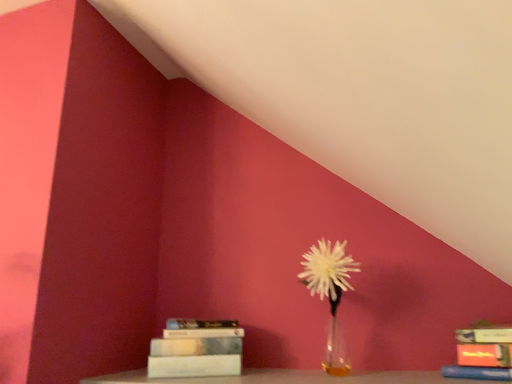
Question: Can we say translucent glass vase at center lies outside hardcover book at lower left, the 1th book positioned from the back?

Choices:
 (A) no
 (B) yes

Answer: (B)

Question: Is translucent glass vase at center wider than hardcover book at lower left, the 1th book positioned from the back?

Choices:
 (A) no
 (B) yes

Answer: (B)

Question: Would you consider translucent glass vase at center to be distant from hardcover book at lower left, the 1th book positioned from the back?

Choices:
 (A) no
 (B) yes

Answer: (A)

Question: Is translucent glass vase at center positioned behind hardcover book at lower left, positioned as the second book in front-to-back order?

Choices:
 (A) no
 (B) yes

Answer: (A)

Question: Is translucent glass vase at center facing away from hardcover book at lower left, the first book from the left?

Choices:
 (A) yes
 (B) no

Answer: (B)

Question: Considering the relative sizes of translucent glass vase at center and hardcover book at lower left, the 1th book positioned from the back, in the image provided, is translucent glass vase at center taller than hardcover book at lower left, the 1th book positioned from the back,?

Choices:
 (A) no
 (B) yes

Answer: (A)

Question: Does hardcover book at lower right, which appears as the 1th book when viewed from the right, appear on the left side of white glass vase at center?

Choices:
 (A) yes
 (B) no

Answer: (B)

Question: Is hardcover book at lower right, acting as the second book starting from the back, oriented away from white glass vase at center?

Choices:
 (A) yes
 (B) no

Answer: (B)

Question: Can you see hardcover book at lower right, which is the second book from left to right, touching white glass vase at center?

Choices:
 (A) yes
 (B) no

Answer: (B)

Question: Is the depth of hardcover book at lower right, acting as the second book starting from the back, greater than that of white glass vase at center?

Choices:
 (A) yes
 (B) no

Answer: (B)

Question: Is hardcover book at lower right, marked as the 1th book in a front-to-back arrangement, outside white glass vase at center?

Choices:
 (A) no
 (B) yes

Answer: (B)

Question: Considering the relative positions of translucent glass vase at center and hardcover book at lower right, which is the second book from left to right, in the image provided, is translucent glass vase at center behind hardcover book at lower right, which is the second book from left to right,?

Choices:
 (A) yes
 (B) no

Answer: (B)